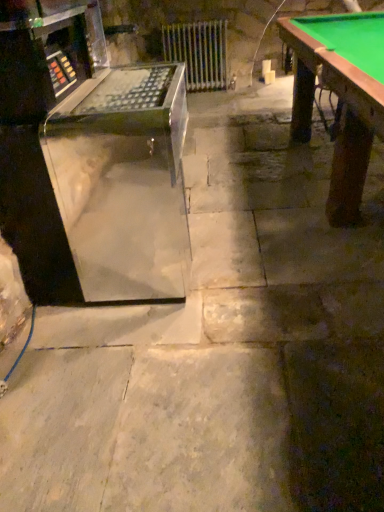
Question: Is the depth of metallic silver radiator at center greater than that of transparent acrylic machine at left?

Choices:
 (A) no
 (B) yes

Answer: (B)

Question: Can you confirm if metallic silver radiator at center is bigger than transparent acrylic machine at left?

Choices:
 (A) no
 (B) yes

Answer: (A)

Question: Are metallic silver radiator at center and transparent acrylic machine at left making contact?

Choices:
 (A) yes
 (B) no

Answer: (B)

Question: From a real-world perspective, is metallic silver radiator at center positioned over transparent acrylic machine at left based on gravity?

Choices:
 (A) yes
 (B) no

Answer: (B)

Question: Are metallic silver radiator at center and transparent acrylic machine at left located far from each other?

Choices:
 (A) yes
 (B) no

Answer: (A)

Question: Is metallic silver radiator at center to the left of transparent acrylic machine at left from the viewer's perspective?

Choices:
 (A) yes
 (B) no

Answer: (B)

Question: Does transparent acrylic machine at left lie behind metallic silver radiator at center?

Choices:
 (A) yes
 (B) no

Answer: (B)

Question: Is there a large distance between transparent acrylic machine at left and metallic silver radiator at center?

Choices:
 (A) no
 (B) yes

Answer: (B)

Question: Is transparent acrylic machine at left facing towards metallic silver radiator at center?

Choices:
 (A) yes
 (B) no

Answer: (B)

Question: Is transparent acrylic machine at left beside metallic silver radiator at center?

Choices:
 (A) yes
 (B) no

Answer: (B)

Question: Does transparent acrylic machine at left have a greater height compared to metallic silver radiator at center?

Choices:
 (A) yes
 (B) no

Answer: (A)

Question: Can you confirm if transparent acrylic machine at left is positioned to the left of metallic silver radiator at center?

Choices:
 (A) no
 (B) yes

Answer: (B)

Question: From the image's perspective, is transparent acrylic machine at left positioned above or below metallic silver radiator at center?

Choices:
 (A) below
 (B) above

Answer: (A)